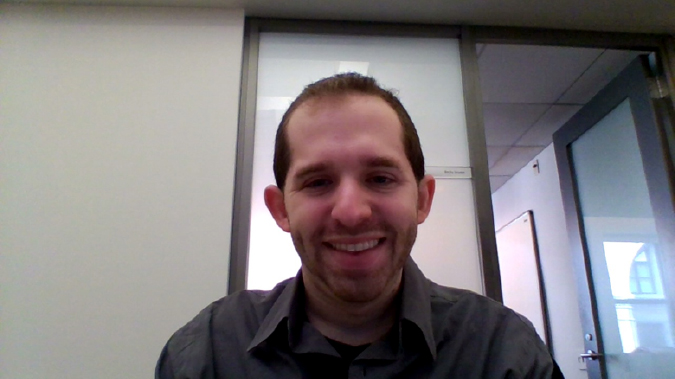
Locate an element on the screen. handle is located at coordinates (583, 360).